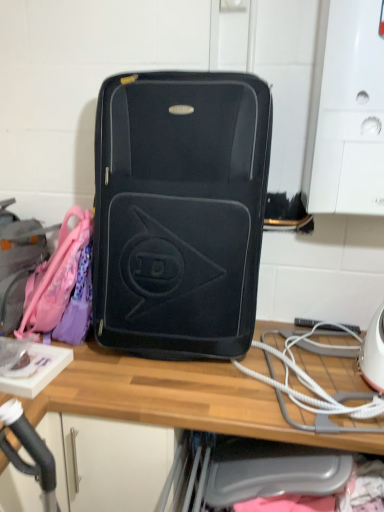
The height and width of the screenshot is (512, 384). What are the coordinates of `vacant area that is in front of matte black suitcase at center` in the screenshot? It's located at (173, 391).